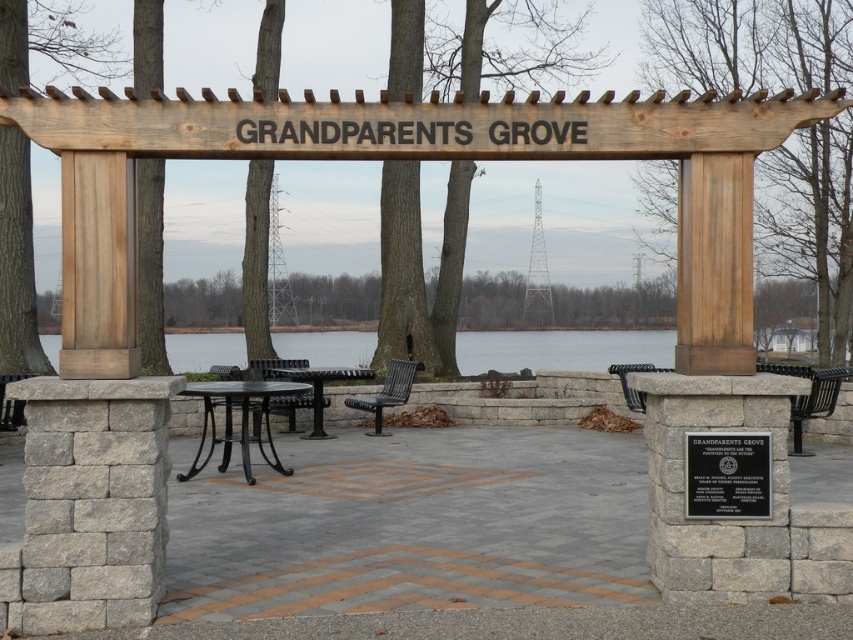
Question: Estimate the real-world distances between objects in this image. Which object is farther from the black textured bench at center?

Choices:
 (A) metallic black picnic table at center
 (B) brown wooden post at right
 (C) black metal park bench at right
 (D) black polished stone plaque at center

Answer: (D)

Question: Is brown wooden sign at center bigger than brown wooden post at right?

Choices:
 (A) yes
 (B) no

Answer: (A)

Question: Is brown wooden sign at center positioned before black polished stone plaque at center?

Choices:
 (A) no
 (B) yes

Answer: (B)

Question: Can you confirm if brown wooden post at right is bigger than black polished stone plaque at center?

Choices:
 (A) no
 (B) yes

Answer: (B)

Question: Based on their relative distances, which object is farther from the clear water at center?

Choices:
 (A) brown wooden post at right
 (B) black metal bench at center
 (C) black wrought iron picnic table at center

Answer: (C)

Question: Which object appears closest to the camera in this image?

Choices:
 (A) clear water at center
 (B) black metal park bench at right
 (C) black metal bench at center
 (D) black textured bench at center

Answer: (B)